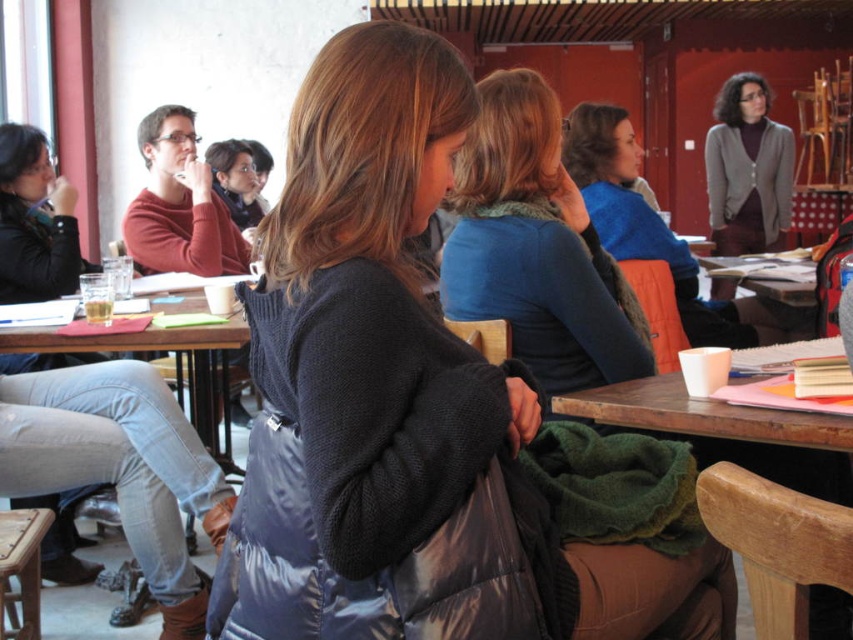
You are standing in the classroom and want to place a book on the wooden table at lower left. To do this, you need to move the blue fuzzy sweater at center out of the way. Is the sweater currently blocking the table?

The blue fuzzy sweater at center is closer to the viewer than the wooden table at lower left, so it is blocking the table and needs to be moved to access it.

You are standing in the classroom and need to place a small plant pot on the surface that is higher between the blue fuzzy sweater at center and the wooden table at lower left. Which surface should you choose?

The blue fuzzy sweater at center is much taller than the wooden table at lower left, so you should place the small plant pot on the blue fuzzy sweater at center.